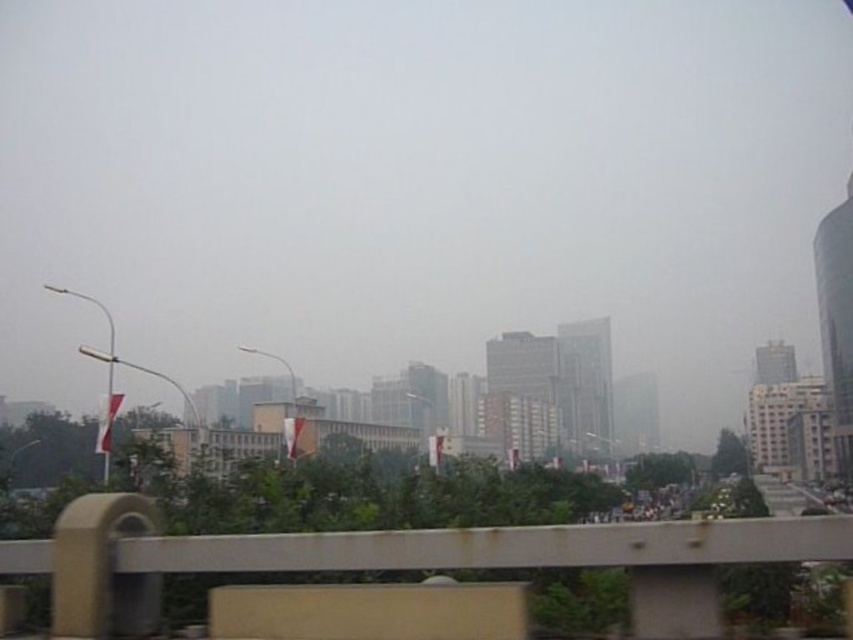
Question: Which point appears closest to the camera in this image?

Choices:
 (A) (107, 396)
 (B) (404, 556)

Answer: (B)

Question: Is rusty metal overpass at lower center further to the viewer compared to white fabric flag at left?

Choices:
 (A) yes
 (B) no

Answer: (B)

Question: Observing the image, what is the correct spatial positioning of rusty metal overpass at lower center in reference to white fabric flag at left?

Choices:
 (A) right
 (B) left

Answer: (A)

Question: Does rusty metal overpass at lower center come behind white fabric flag at left?

Choices:
 (A) yes
 (B) no

Answer: (B)